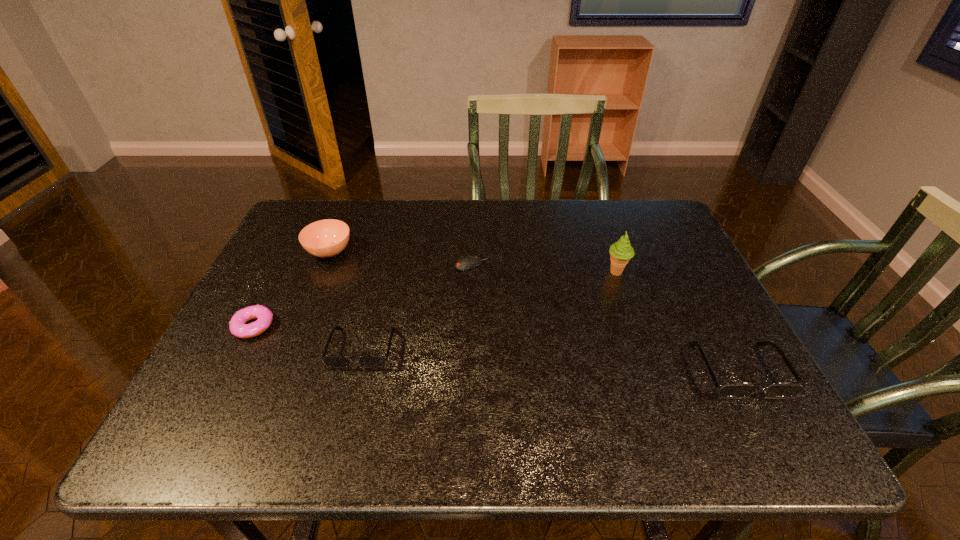
To achieve uniform spacing by inserting another sunglasses among them, please point to a free space for this new sunglasses. Please provide its 2D coordinates. Your answer should be formatted as a tuple, i.e. [(x, y)], where the tuple contains the x and y coordinates of a point satisfying the conditions above.

[(546, 359)]